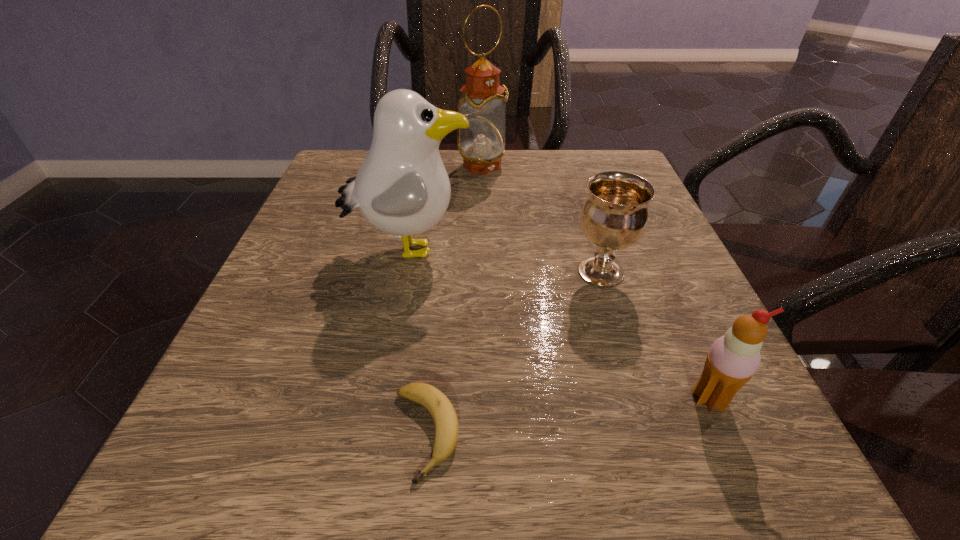
In order to click on oil lamp in this screenshot , I will do `click(481, 145)`.

What are the coordinates of `the fourth shortest object` in the screenshot? It's located at [402, 188].

Locate an element on the screen. This screenshot has height=540, width=960. chalice is located at coordinates (614, 216).

The width and height of the screenshot is (960, 540). Find the location of `the rightmost object`. the rightmost object is located at coordinates (733, 359).

Locate an element on the screen. the shortest object is located at coordinates (444, 415).

Locate an element on the screen. free spot located on the front of the oil lamp is located at coordinates (482, 212).

Locate an element on the screen. This screenshot has height=540, width=960. blank space located on the beak of the second tallest object is located at coordinates (510, 249).

Locate an element on the screen. vacant region located 0.170m on the back of the second object from right to left is located at coordinates [x=580, y=202].

Where is `vacant space located at the front with a straw on the icecream`? This screenshot has width=960, height=540. vacant space located at the front with a straw on the icecream is located at coordinates (747, 482).

You are a GUI agent. You are given a task and a screenshot of the screen. Output one action in this format:
    pyautogui.click(x=<x>, y=<y>)
    Task: Click on the free spot located on the right of the banana
    Image resolution: width=960 pixels, height=540 pixels.
    Given the screenshot: What is the action you would take?
    point(667,434)